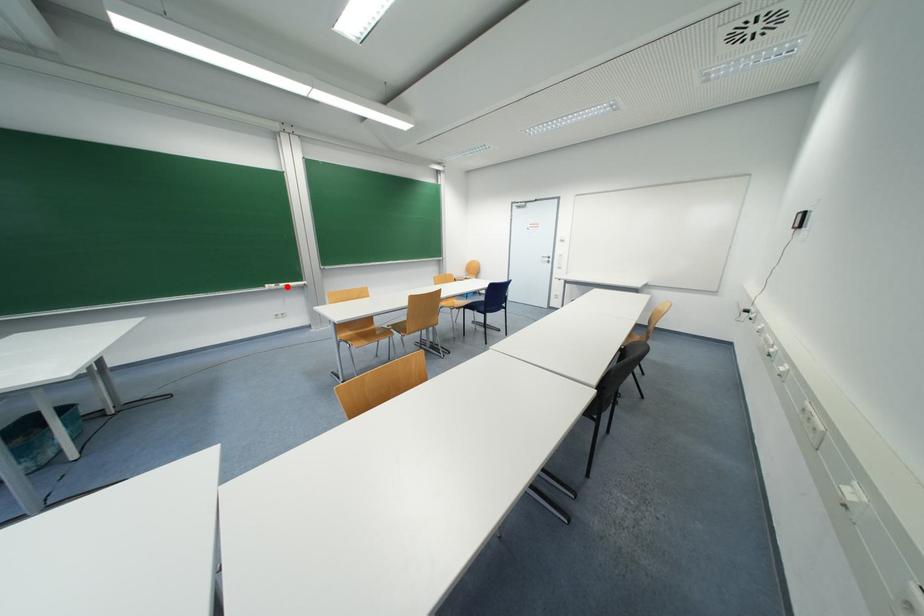
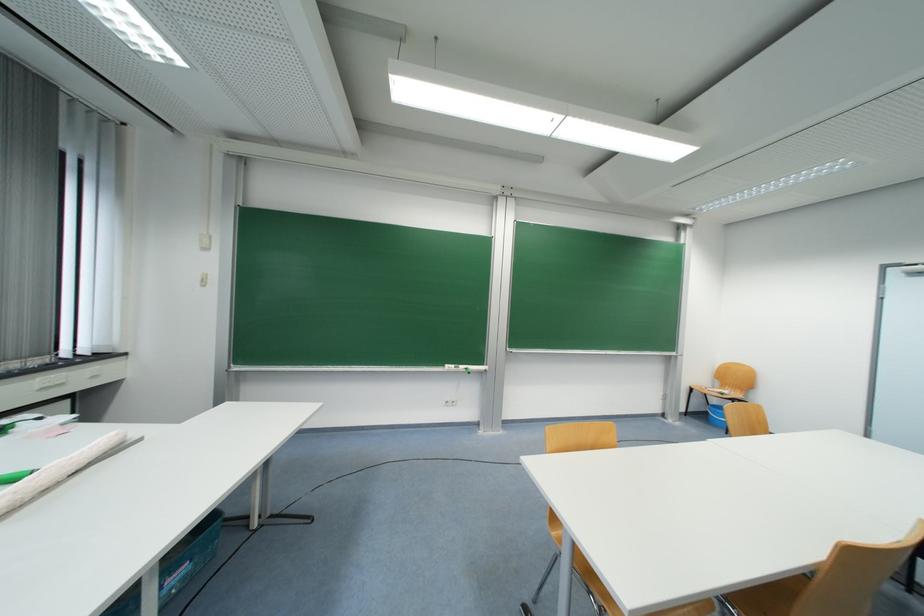
In the second image, find the point that corresponds to the highlighted location in the first image.

(467, 369)